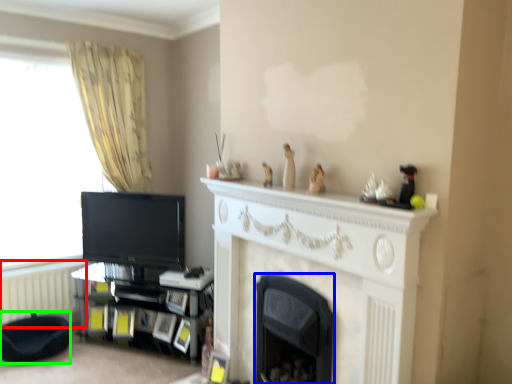
Question: Which object is the closest to the radiator (highlighted by a red box)? Choose among these: fireplace (highlighted by a blue box) or footrest (highlighted by a green box).

Choices:
 (A) fireplace
 (B) footrest

Answer: (B)